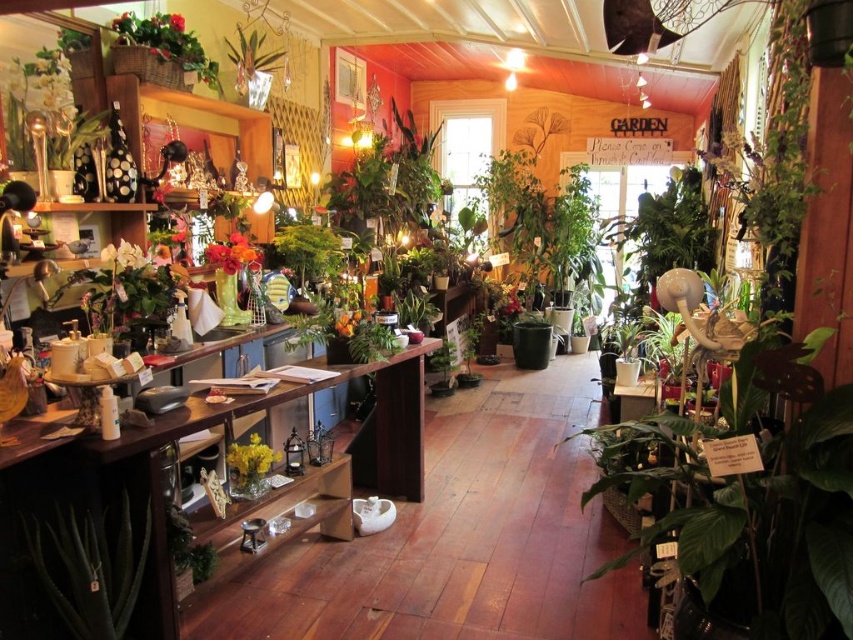
Can you confirm if green wicker basket at upper left is wider than matte orange vase at center?

Indeed, green wicker basket at upper left has a greater width compared to matte orange vase at center.

Based on the photo, measure the distance from green wicker basket at upper left to matte orange vase at center.

A distance of 37.34 inches exists between green wicker basket at upper left and matte orange vase at center.

Does point (161, 16) come closer to viewer compared to point (229, 253)?

Yes, it is.

The image size is (853, 640). What are the coordinates of `green wicker basket at upper left` in the screenshot? It's located at (161, 52).

Is point (228, 449) in front of point (113, 259)?

No, (228, 449) is behind (113, 259).

Who is positioned more to the left, yellow matte vase at center or white matte flower at left?

white matte flower at left

Is point (247, 445) positioned behind point (119, 244)?

No, (247, 445) is in front of (119, 244).

Where is `yellow matte vase at center`? Image resolution: width=853 pixels, height=640 pixels. yellow matte vase at center is located at coordinates (250, 458).

Can you confirm if yellow matte vase at center is wider than matte orange vase at center?

Incorrect, yellow matte vase at center's width does not surpass matte orange vase at center's.

Does point (253, 477) come farther from viewer compared to point (230, 272)?

No, it is not.

What do you see at coordinates (250, 458) in the screenshot? This screenshot has width=853, height=640. I see `yellow matte vase at center` at bounding box center [250, 458].

Locate an element on the screen. The image size is (853, 640). yellow matte vase at center is located at coordinates (250, 458).